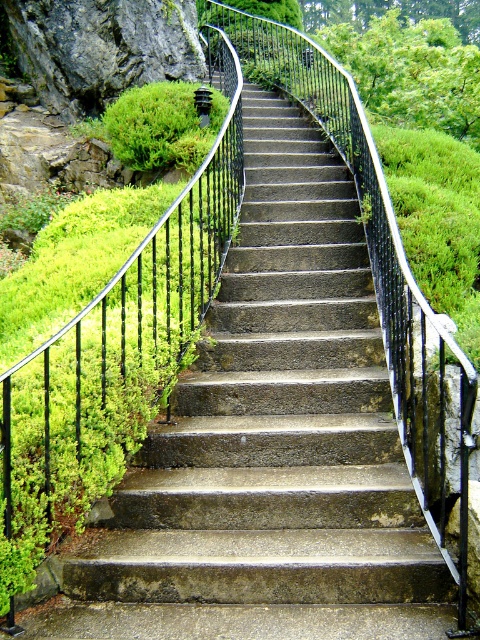
Question: Can you confirm if concrete stairs at center is bigger than green mossy rock at upper left?

Choices:
 (A) no
 (B) yes

Answer: (B)

Question: Can you confirm if concrete stairs at center is positioned to the left of green mossy rock at upper left?

Choices:
 (A) yes
 (B) no

Answer: (B)

Question: Observing the image, what is the correct spatial positioning of concrete stairs at center in reference to green mossy rock at upper left?

Choices:
 (A) above
 (B) below

Answer: (B)

Question: Which point is farther to the camera?

Choices:
 (A) concrete stairs at center
 (B) green mossy rock at upper left

Answer: (B)

Question: Which of the following is the closest to the observer?

Choices:
 (A) (299, 509)
 (B) (223, 97)

Answer: (A)